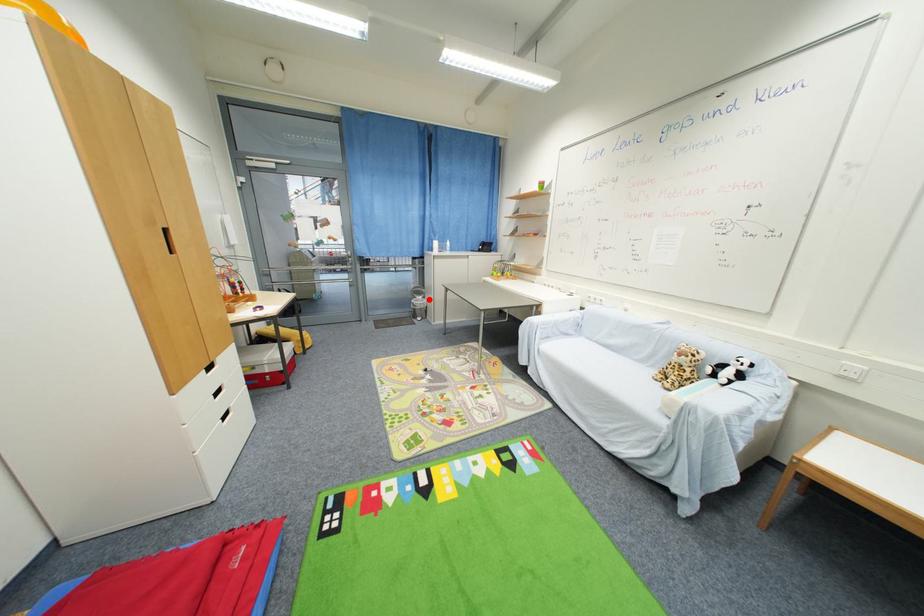
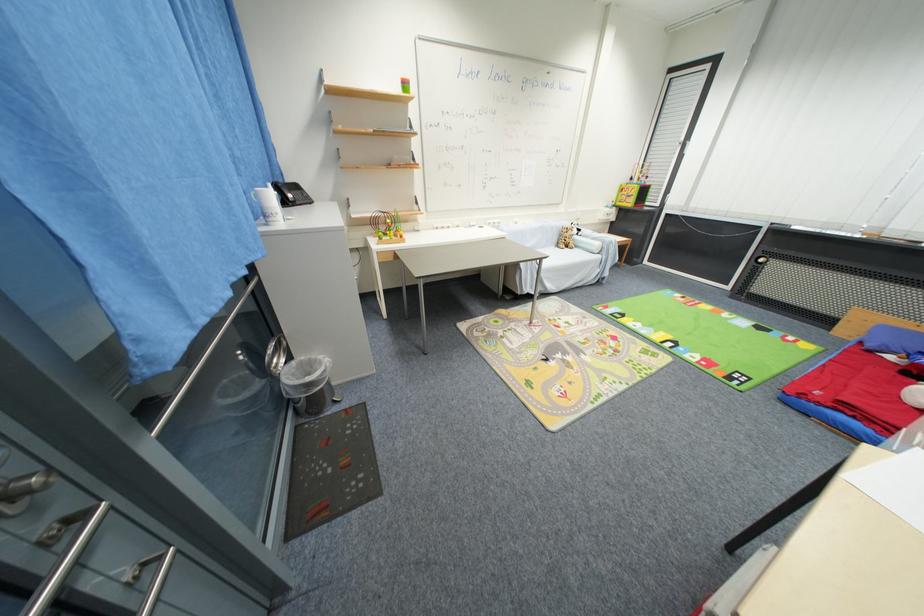
Where in the second image is the point corresponding to the highlighted location from the first image?

(295, 360)